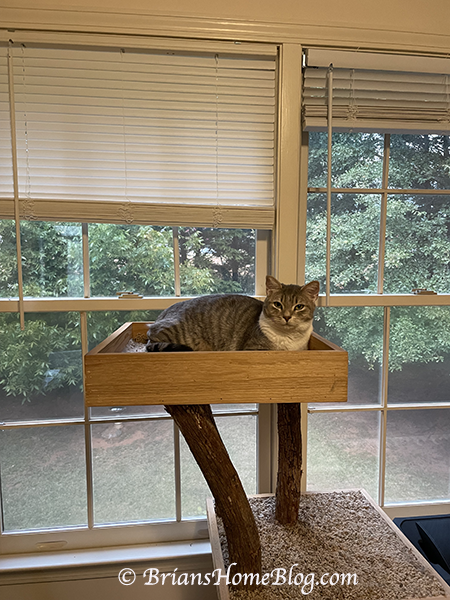
Identify the location of windows. (115, 470), (333, 441).